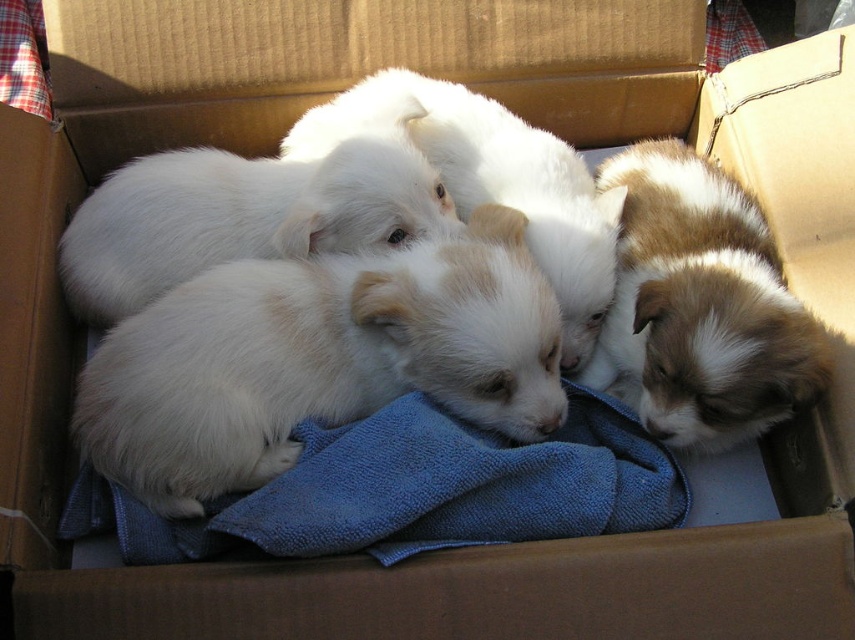
You are a photographer trying to capture a closeup of the brown and white fur at right without moving the white fluffy puppies at center. Is it possible to do so from your current position?

The brown and white fur at right is behind the white fluffy puppies at center, so it might be blocked by the puppies. You may need to adjust your angle or move slightly to get a clear shot without disturbing them.